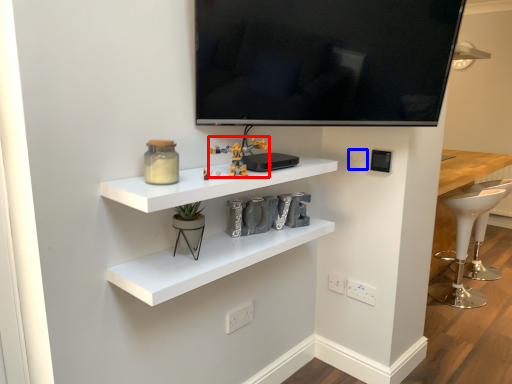
Question: Which object appears farthest to the camera in this image, toy (highlighted by a red box) or electric outlet (highlighted by a blue box)?

Choices:
 (A) toy
 (B) electric outlet

Answer: (B)